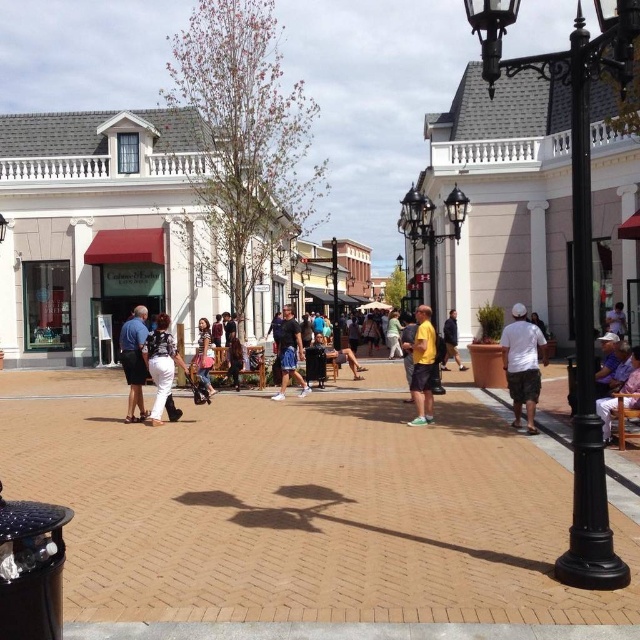
Is brick pavement at center smaller than light blue shirt at center?

Actually, brick pavement at center might be larger than light blue shirt at center.

Looking at this image, can you confirm if brick pavement at center is positioned to the right of light blue shirt at center?

No, brick pavement at center is not to the right of light blue shirt at center.

Does point (465, 579) lie in front of point (624, 332)?

Yes, point (465, 579) is closer to viewer.

The width and height of the screenshot is (640, 640). Identify the location of brick pavement at center. (304, 506).

This screenshot has width=640, height=640. I want to click on white matte shirt at right, so click(x=522, y=364).

Who is more forward, (500, 333) or (432, 300)?

Positioned in front is point (500, 333).

Where is `white matte shirt at right`? white matte shirt at right is located at coordinates (522, 364).

Does black wrought iron lamp post at right appear on the right side of purple fabric chair at lower right?

Yes, black wrought iron lamp post at right is to the right of purple fabric chair at lower right.

This screenshot has height=640, width=640. I want to click on black wrought iron lamp post at right, so click(x=576, y=253).

Locate an element on the screen. The image size is (640, 640). black wrought iron lamp post at right is located at coordinates (576, 253).